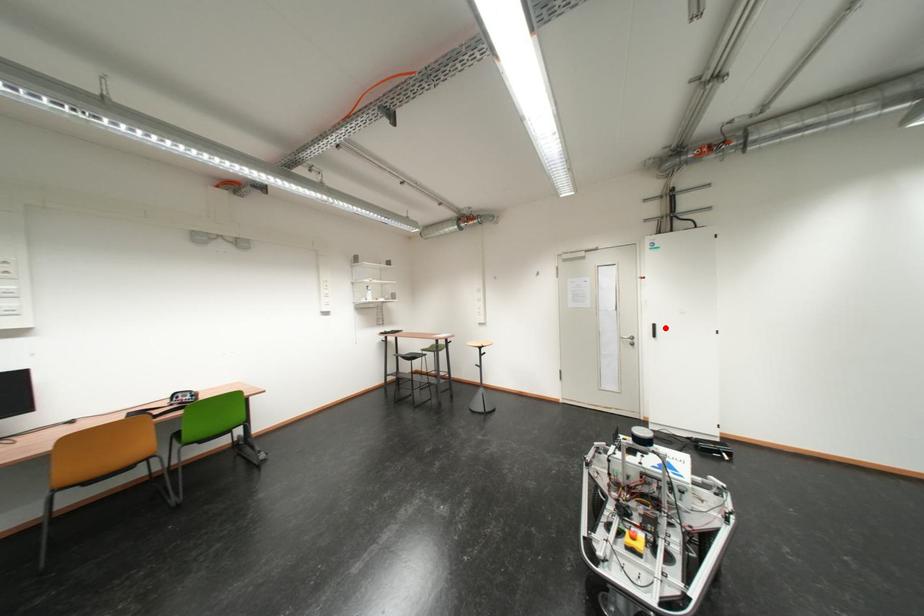
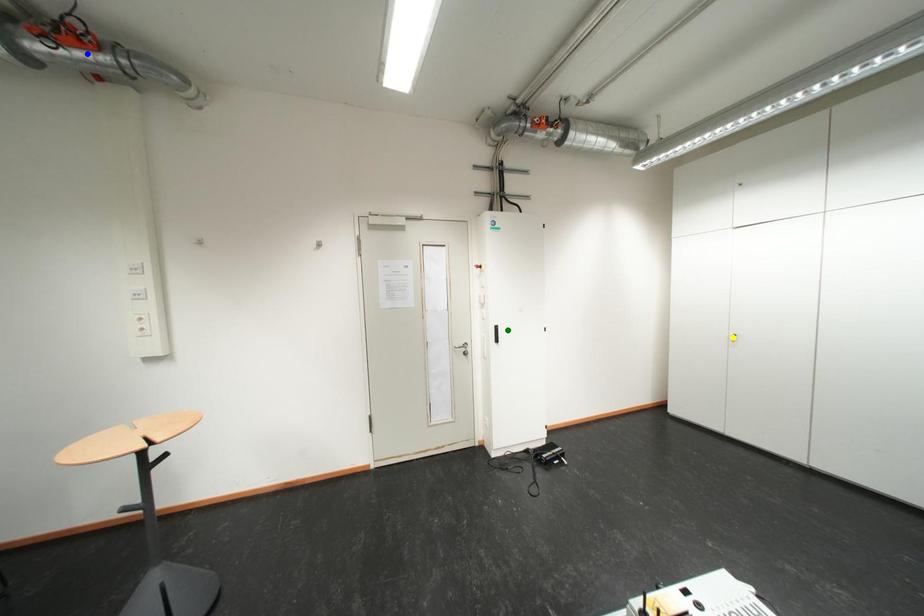
Question: I am providing you with two images of the same scene from different viewpoints. A red point is marked on the first image. You are given multiple points on the second image. Which point in image 2 represents the same 3d spot as the red point in image 1?

Choices:
 (A) blue point
 (B) green point
 (C) yellow point

Answer: (B)